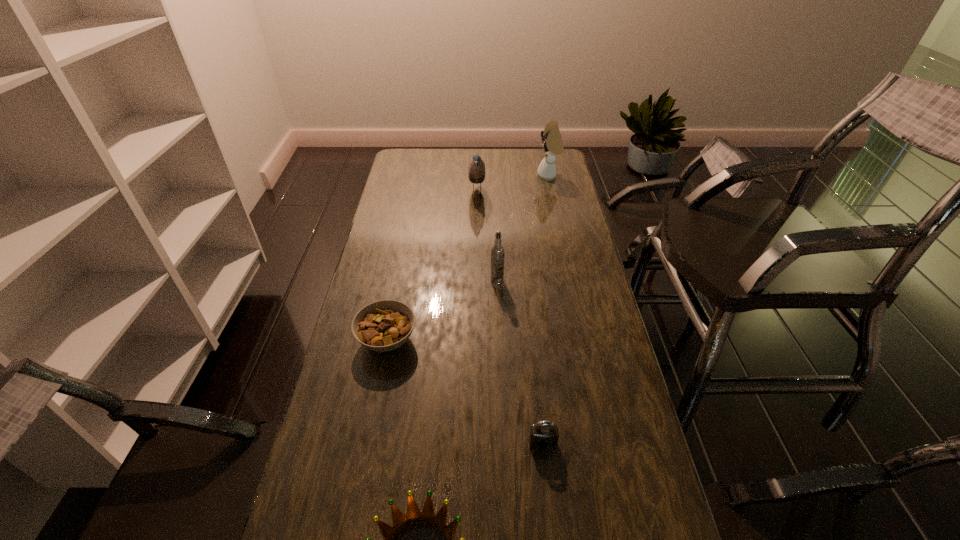
I want to click on vacant space located 0.260m at the front face of the rightmost object, so click(481, 176).

The height and width of the screenshot is (540, 960). Identify the location of vacant area situated at the front face of the rightmost object. (472, 176).

The image size is (960, 540). Identify the location of blank area located on the label of the fourth object from left to right. (499, 350).

Identify the location of blank space located 0.120m at the tip of the bird's beak. This screenshot has width=960, height=540. (513, 195).

The width and height of the screenshot is (960, 540). What are the coordinates of `vacant space positioned 0.140m at the front of the second object from right to left near the keyhole` in the screenshot? It's located at tap(550, 511).

The width and height of the screenshot is (960, 540). Identify the location of vacant space situated 0.330m on the right of the shortest object. (526, 340).

The width and height of the screenshot is (960, 540). Identify the location of object that is at the far edge. (552, 144).

Where is `object at the left edge`? object at the left edge is located at coordinates (385, 325).

Identify the location of object at the right edge. This screenshot has width=960, height=540. (552, 144).

I want to click on object positioned at the far right corner, so click(552, 144).